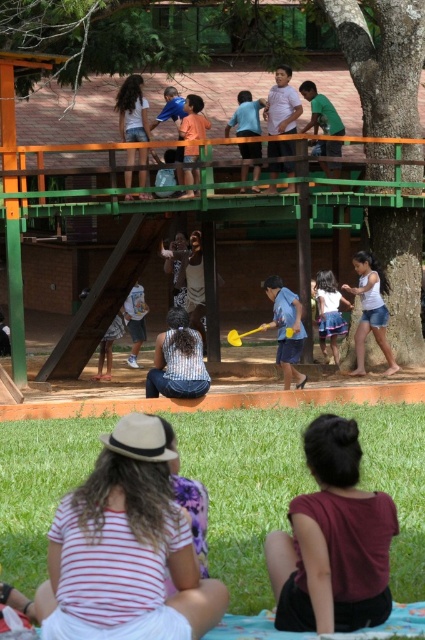
Is green rough bark tree at upper center above green rough bark tree at center?

Yes, green rough bark tree at upper center is above green rough bark tree at center.

Who is more distant from viewer, (x=333, y=1) or (x=340, y=28)?

Point (x=340, y=28)

The height and width of the screenshot is (640, 425). I want to click on green rough bark tree at upper center, so click(379, 58).

Between point (30, 557) and point (342, 330), which one is positioned behind?

Point (342, 330)

Between point (88, 448) and point (331, 310), which one is positioned in front?

Positioned in front is point (88, 448).

Where is `green grass at lower center`? This screenshot has height=640, width=425. green grass at lower center is located at coordinates (297, 484).

Is green rough bark tree at center smaller than blue denim skirt at center?

Yes.

Based on the photo, who is more distant from viewer, (x=345, y=1) or (x=345, y=330)?

Positioned behind is point (x=345, y=330).

Locate an element on the screen. The image size is (425, 640). green rough bark tree at center is located at coordinates (382, 60).